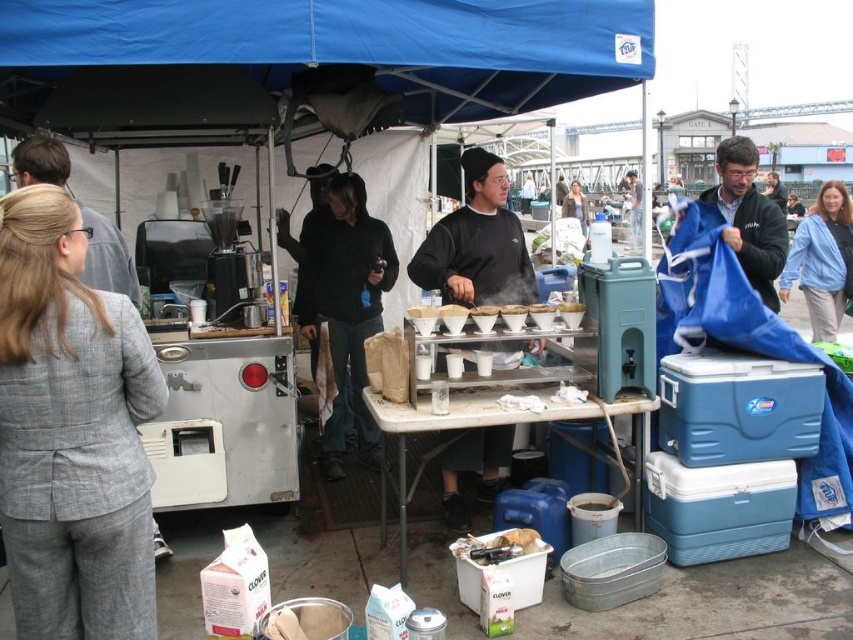
Based on the scene description, what object is located at the coordinates point (477, 243)?

The object at point (477, 243) is the black matte sweatshirt at center.

You are a customer at the food stall and want to grab a disposable cup for your drink. You see the dark blue fabric at right and the white paper cone at center. Which object is closer to your right hand if you are facing the table?

The dark blue fabric at right is positioned on the right side of white paper cone at center, so it is closer to your right hand.

You are at the food stall and need to place an order. Where is the gray wool suit at left located in the scene?

The gray wool suit at left is located at point 0.677 on the x axis and 0.084 on the y axis.